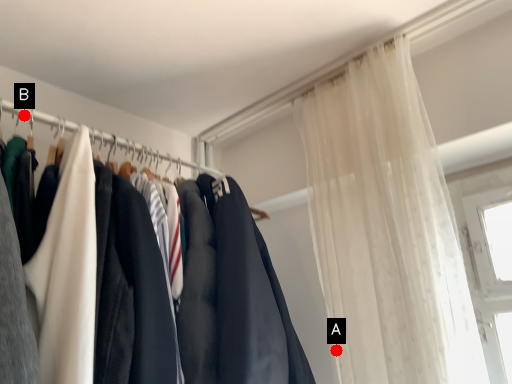
Question: Two points are circled on the image, labeled by A and B beside each circle. Which point is closer to the camera taking this photo?

Choices:
 (A) A is closer
 (B) B is closer

Answer: (B)